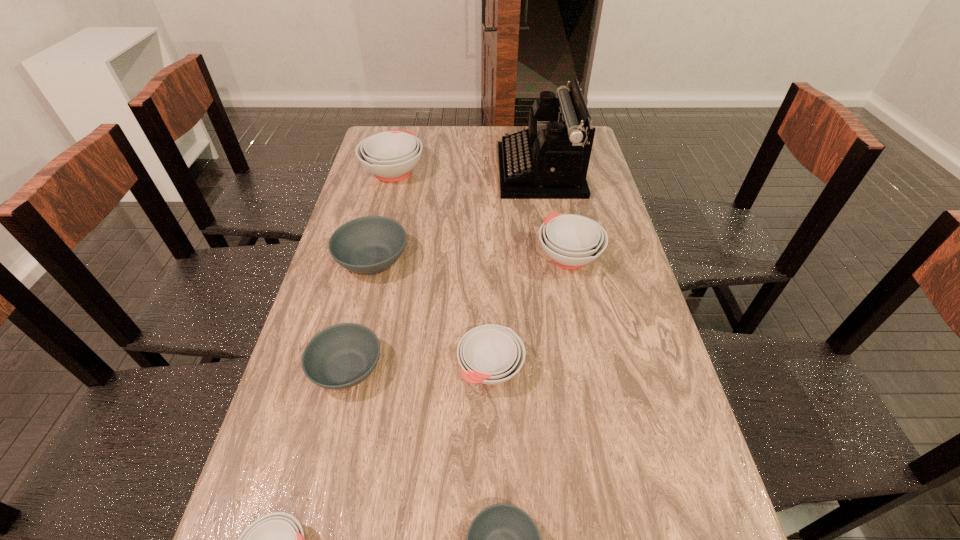
The image size is (960, 540). Find the location of `free space located on the typing side of the black typewriter`. free space located on the typing side of the black typewriter is located at coordinates (420, 171).

Find the location of a particular element. This screenshot has height=540, width=960. vacant space located on the typing side of the black typewriter is located at coordinates (396, 171).

This screenshot has width=960, height=540. I want to click on vacant space located 0.250m on the typing side of the black typewriter, so click(429, 171).

In order to click on free region located 0.050m on the right of the seventh shortest object in this screenshot , I will do `click(439, 172)`.

Where is `free space located on the left of the third nearest white soup bowl`? This screenshot has width=960, height=540. free space located on the left of the third nearest white soup bowl is located at coordinates (498, 256).

Locate an element on the screen. The height and width of the screenshot is (540, 960). vacant space situated on the right of the farthest gray soup bowl is located at coordinates (483, 260).

At what (x,y) coordinates should I click in order to perform the action: click on vacant space located on the front of the second nearest white soup bowl. Please return your answer as a coordinate pair (x, y). This screenshot has height=540, width=960. Looking at the image, I should click on (492, 454).

Locate an element on the screen. The image size is (960, 540). free space located on the right of the second farthest gray soup bowl is located at coordinates (476, 369).

Image resolution: width=960 pixels, height=540 pixels. Identify the location of typewriter that is at the far edge. click(549, 160).

Find the location of a particular element. Image resolution: width=960 pixels, height=540 pixels. soup bowl situated at the far edge is located at coordinates (391, 155).